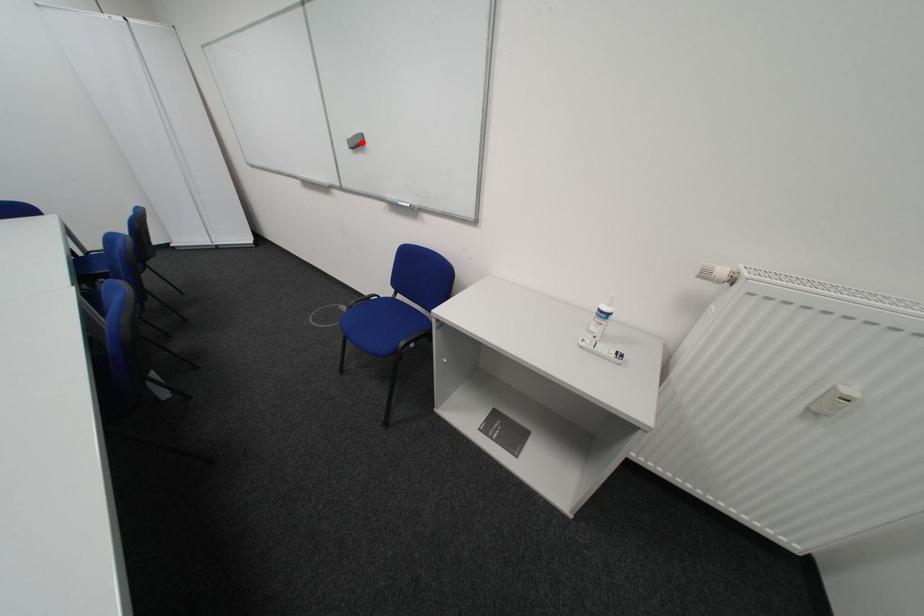
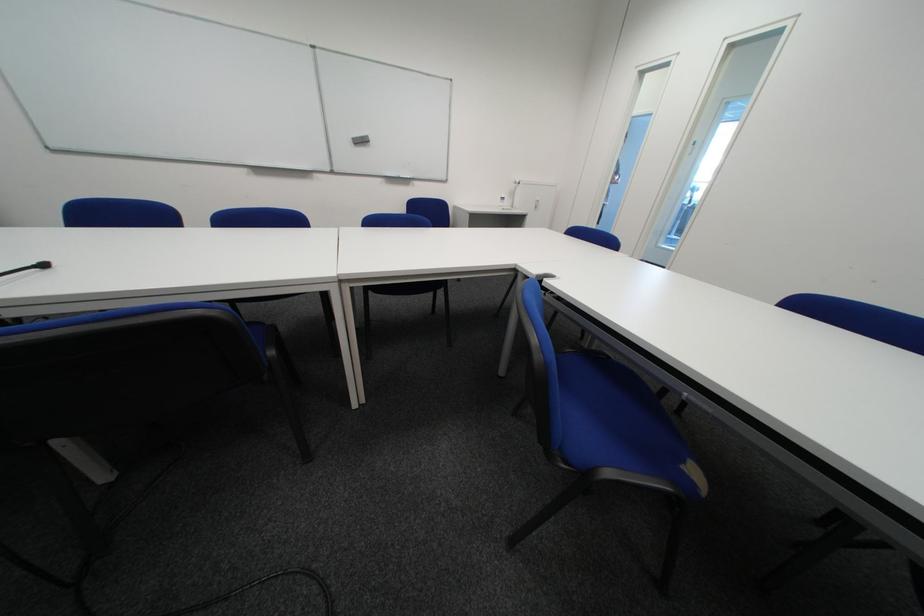
Locate, in the second image, the point that corresponds to the highlighted location in the first image.

(365, 140)